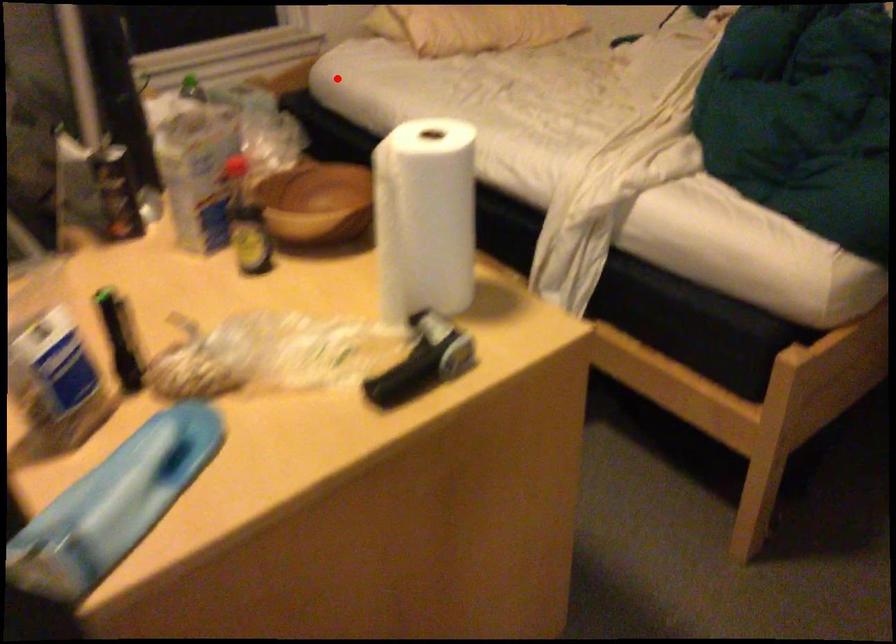
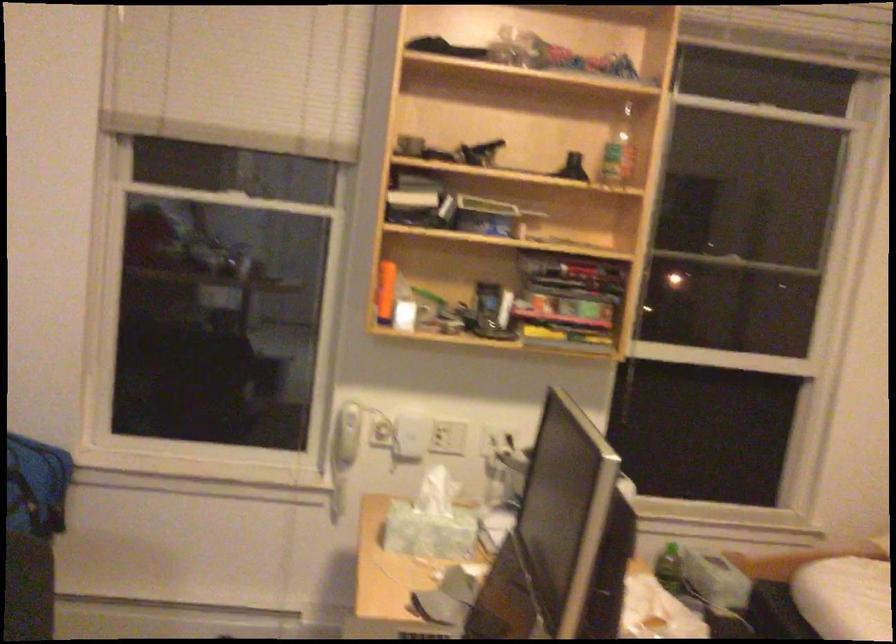
Question: I am providing you with two images of the same scene from different viewpoints. Given a red point in image1, look at the same physical point in image2. Is it:

Choices:
 (A) Closer to the viewpoint
 (B) Farther from the viewpoint

Answer: (A)